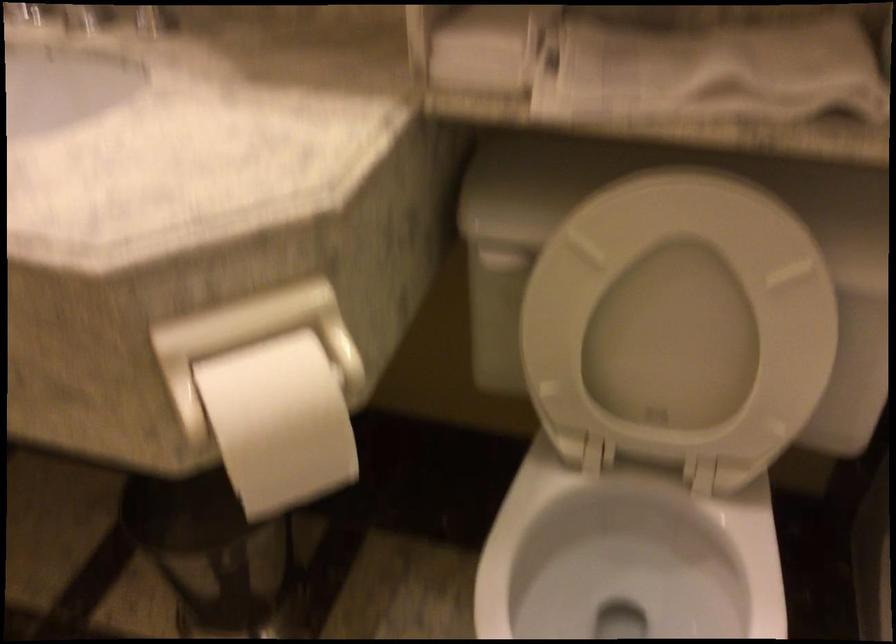
Find the location of a particular element. The image size is (896, 644). white toilet lid is located at coordinates (678, 322).